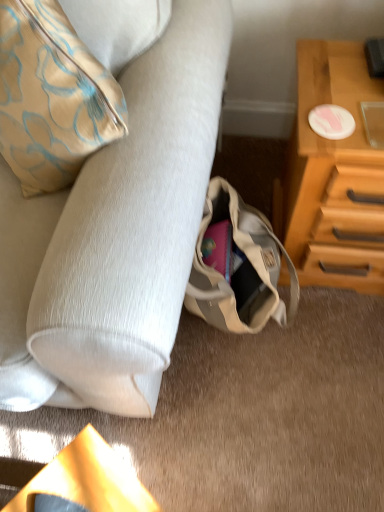
Question: Does beige canvas bag at lower center have a larger size compared to suede-like beige couch at lower left?

Choices:
 (A) no
 (B) yes

Answer: (A)

Question: Considering the relative sizes of beige canvas bag at lower center and suede-like beige couch at lower left in the image provided, is beige canvas bag at lower center thinner than suede-like beige couch at lower left?

Choices:
 (A) yes
 (B) no

Answer: (A)

Question: From the image's perspective, would you say beige canvas bag at lower center is shown under suede-like beige couch at lower left?

Choices:
 (A) yes
 (B) no

Answer: (A)

Question: Is the depth of beige canvas bag at lower center greater than that of suede-like beige couch at lower left?

Choices:
 (A) no
 (B) yes

Answer: (B)

Question: Does beige canvas bag at lower center appear on the left side of suede-like beige couch at lower left?

Choices:
 (A) no
 (B) yes

Answer: (A)

Question: Looking at the image, does wooden chest of drawers at right seem bigger or smaller compared to suede-like beige couch at lower left?

Choices:
 (A) big
 (B) small

Answer: (B)

Question: Considering their positions, is wooden chest of drawers at right located in front of or behind suede-like beige couch at lower left?

Choices:
 (A) behind
 (B) front

Answer: (A)

Question: From the image's perspective, relative to suede-like beige couch at lower left, is wooden chest of drawers at right above or below?

Choices:
 (A) below
 (B) above

Answer: (A)

Question: Is wooden chest of drawers at right inside the boundaries of suede-like beige couch at lower left, or outside?

Choices:
 (A) outside
 (B) inside

Answer: (A)

Question: In terms of size, does wooden chest of drawers at right appear bigger or smaller than beige canvas bag at lower center?

Choices:
 (A) small
 (B) big

Answer: (B)

Question: Is point (329, 143) closer or farther from the camera than point (187, 291)?

Choices:
 (A) closer
 (B) farther

Answer: (A)

Question: From their relative heights in the image, would you say wooden chest of drawers at right is taller or shorter than beige canvas bag at lower center?

Choices:
 (A) tall
 (B) short

Answer: (A)

Question: Is wooden chest of drawers at right inside the boundaries of beige canvas bag at lower center, or outside?

Choices:
 (A) inside
 (B) outside

Answer: (B)

Question: From the image's perspective, is suede-like beige couch at lower left positioned above or below wooden chest of drawers at right?

Choices:
 (A) below
 (B) above

Answer: (B)

Question: Does point (155, 155) appear closer or farther from the camera than point (357, 84)?

Choices:
 (A) closer
 (B) farther

Answer: (A)